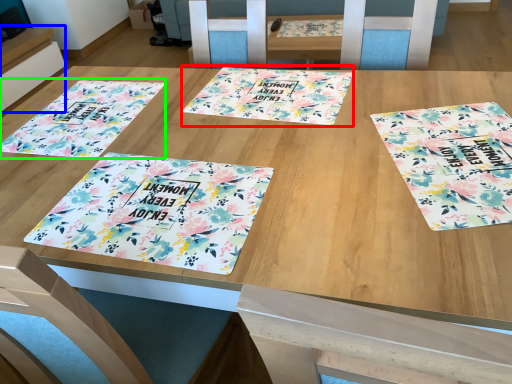
Question: Which object is the closest to the yoga mat (highlighted by a red box)? Choose among these: table (highlighted by a blue box) or tablecloth (highlighted by a green box).

Choices:
 (A) table
 (B) tablecloth

Answer: (B)